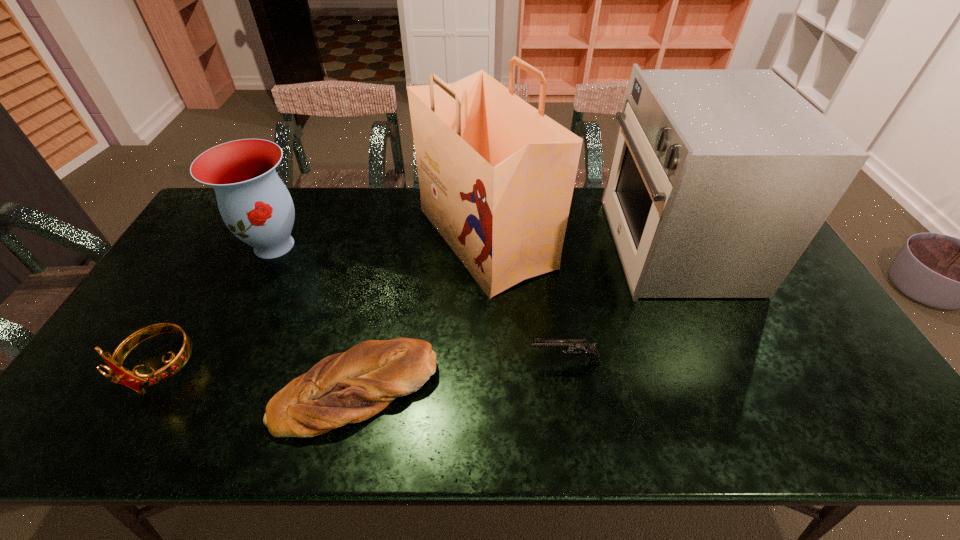
Where is `free space that satisfies the following two spatial constraints: 1. on the front panel of the rightmost object; 2. on the front-facing side of the tiara`? free space that satisfies the following two spatial constraints: 1. on the front panel of the rightmost object; 2. on the front-facing side of the tiara is located at coordinates (728, 368).

Locate an element on the screen. The image size is (960, 540). free spot that satisfies the following two spatial constraints: 1. at the end of the barrel of the gun; 2. on the front-facing side of the third shortest object is located at coordinates (565, 368).

Identify the location of free point that satisfies the following two spatial constraints: 1. on the front panel of the rightmost object; 2. on the front-facing side of the fourth tallest object. (728, 368).

Where is `free region that satisfies the following two spatial constraints: 1. on the side of the grocery bag with the superhero design; 2. on the front-facing side of the third shortest object`? free region that satisfies the following two spatial constraints: 1. on the side of the grocery bag with the superhero design; 2. on the front-facing side of the third shortest object is located at coordinates (487, 368).

The height and width of the screenshot is (540, 960). I want to click on free space that satisfies the following two spatial constraints: 1. on the front-facing side of the fourth tallest object; 2. on the left side of the shortest object, so click(148, 391).